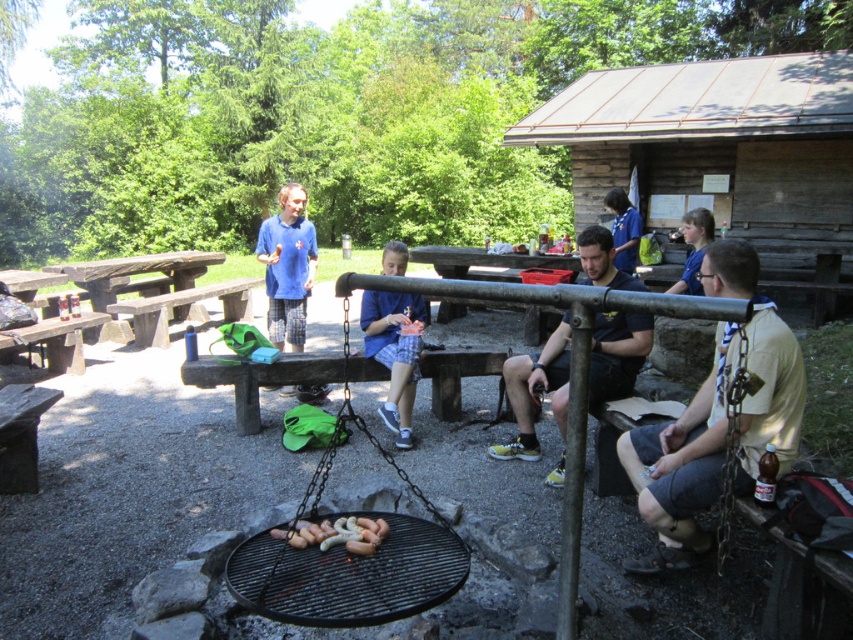
Is tan fabric shirt at center bigger than blue fabric at center?

Yes, tan fabric shirt at center is bigger than blue fabric at center.

Who is positioned more to the right, tan fabric shirt at center or blue fabric at center?

From the viewer's perspective, tan fabric shirt at center appears more on the right side.

Locate an element on the screen. tan fabric shirt at center is located at coordinates (680, 467).

You are a GUI agent. You are given a task and a screenshot of the screen. Output one action in this format:
    pyautogui.click(x=<x>, y=<y>)
    Task: Click on the tan fabric shirt at center
    Image resolution: width=853 pixels, height=640 pixels.
    Given the screenshot: What is the action you would take?
    pyautogui.click(x=680, y=467)

Is tan fabric shirt at center shorter than grilled sausages at center?

No.

Can you confirm if tan fabric shirt at center is smaller than grilled sausages at center?

Incorrect, tan fabric shirt at center is not smaller in size than grilled sausages at center.

Who is more forward, (720, 298) or (373, 547)?

Positioned in front is point (373, 547).

Identify the location of tan fabric shirt at center. (680, 467).

Is tan fabric shirt at center to the left of black matte grill at center from the viewer's perspective?

Incorrect, tan fabric shirt at center is not on the left side of black matte grill at center.

Does tan fabric shirt at center appear under black matte grill at center?

No.

Is point (724, 289) positioned after point (227, 582)?

Yes, point (724, 289) is behind point (227, 582).

The height and width of the screenshot is (640, 853). Find the location of `tan fabric shirt at center`. tan fabric shirt at center is located at coordinates (680, 467).